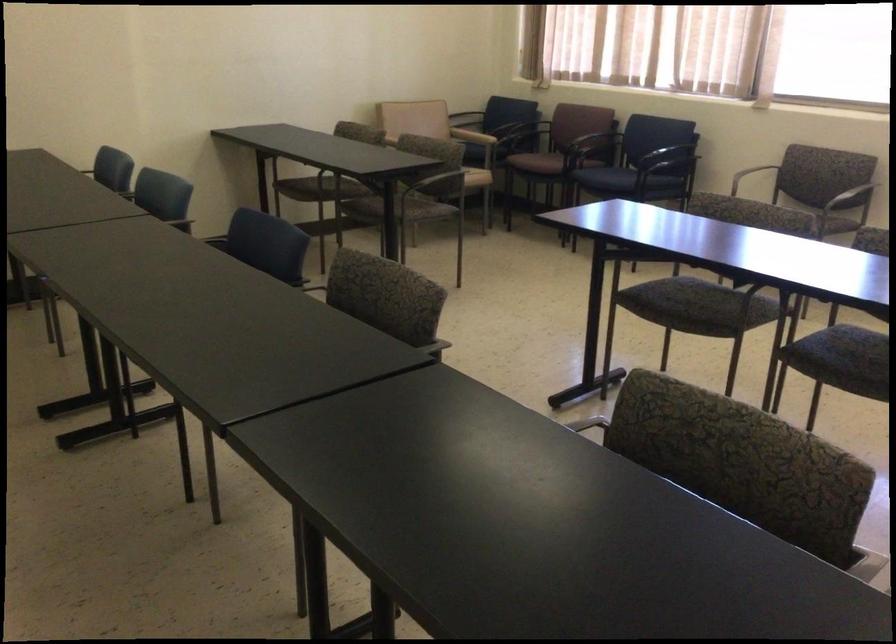
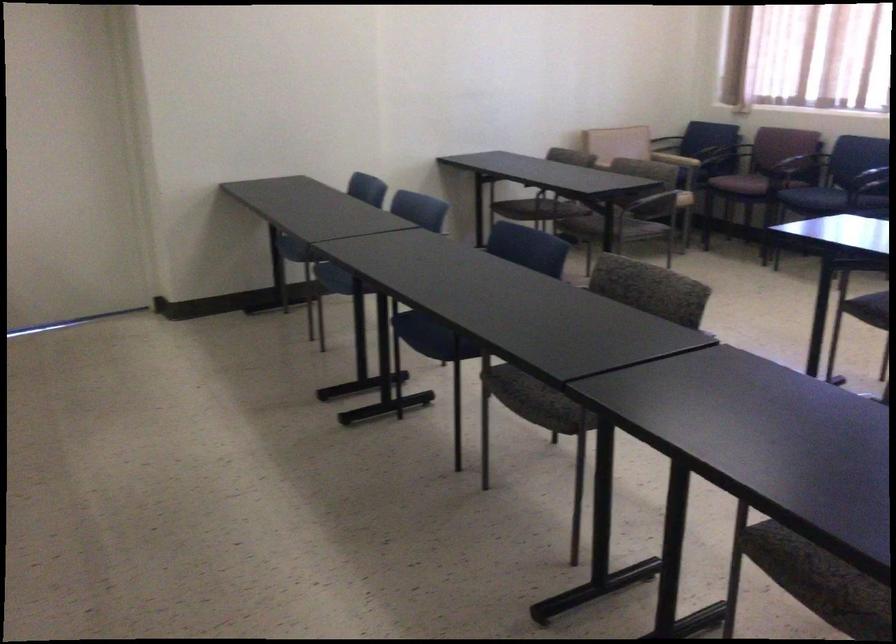
The point at (441, 184) is marked in the first image. Where is the corresponding point in the second image?

(655, 204)